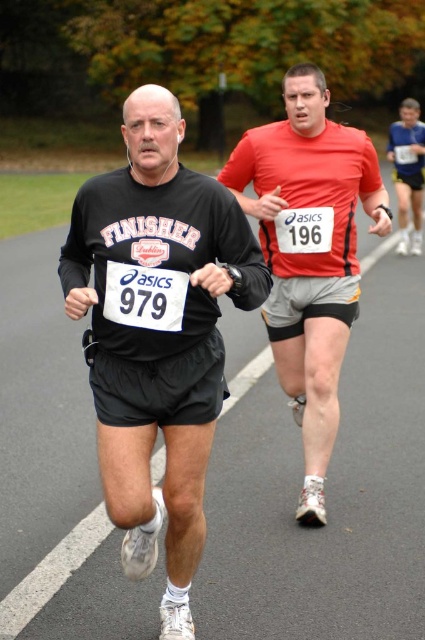
From the picture: You are a photographer at a running event. You need to capture a photo of the black matte running shorts at left and the matte red shorts at right. According to the scene, which runner is positioned to the left of the other?

The black matte running shorts at left is positioned on the left side of matte red shorts at right.

You are a photographer at the finish line of a marathon. You want to capture a photo that includes both the black matte running shorts at left and the matte red shirt at center. Based on their positions, where should you position your camera to ensure both are visible in the frame?

The black matte running shorts at left is located below the matte red shirt at center, so positioning the camera at a higher angle or looking downward would allow both to be captured in the frame.

You are a photographer standing at the finish line of a marathon. You want to take a photo of the runner wearing the black matte running shorts at left. Considering the distance between the runner and the camera, is the runner within the recommended 3 meter range for clear portrait photography?

The distance between the black matte running shorts at left and the camera is 3.02 meters, which is slightly beyond the recommended 3 meter range for clear portrait photography.